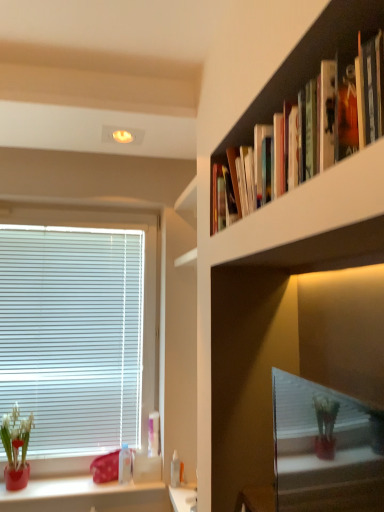
Identify the location of vacant area situated to the left side of transparent plastic bottle at lower left, which ranks as the third toiletry in right-to-left order. The height and width of the screenshot is (512, 384). (92, 483).